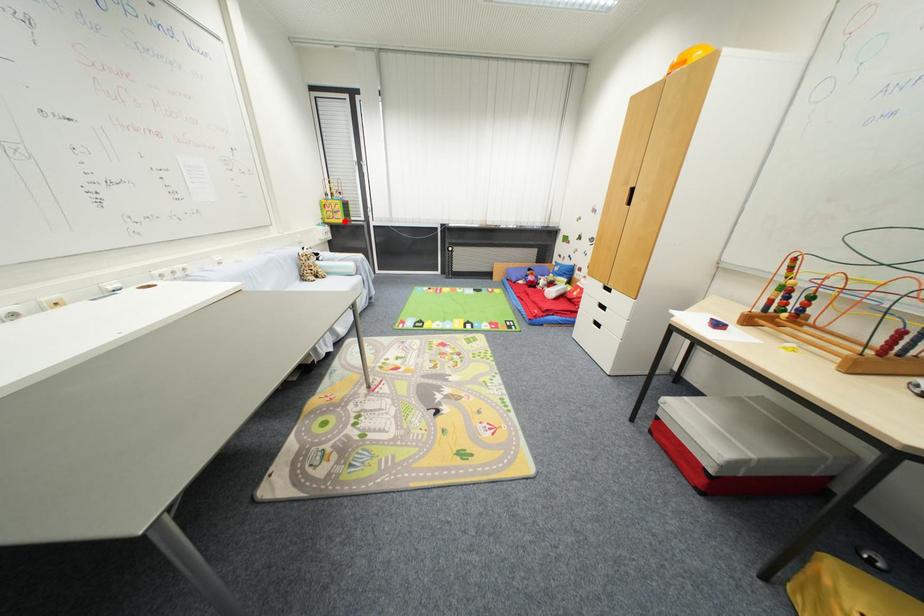
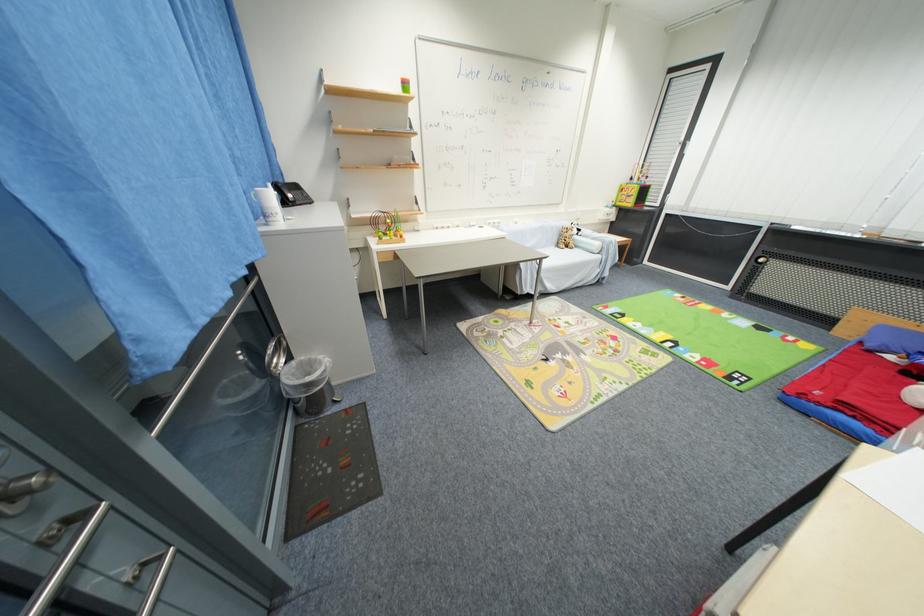
Question: I am providing you with two images of the same scene from different viewpoints. Given a red point in image1, look at the same physical point in image2. Is it:

Choices:
 (A) Closer to the viewpoint
 (B) Farther from the viewpoint

Answer: (A)